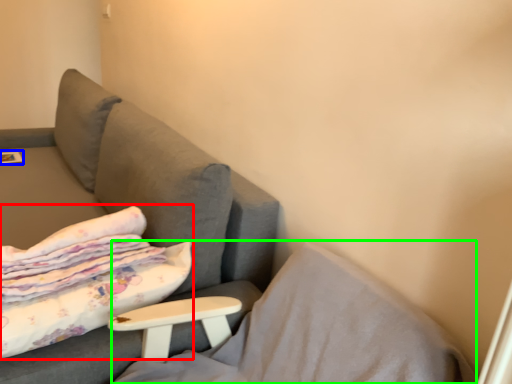
Question: Estimate the real-world distances between objects in this image. Which object is closer to bed (highlighted by a red box), magazine (highlighted by a blue box) or pillow (highlighted by a green box)?

Choices:
 (A) magazine
 (B) pillow

Answer: (B)